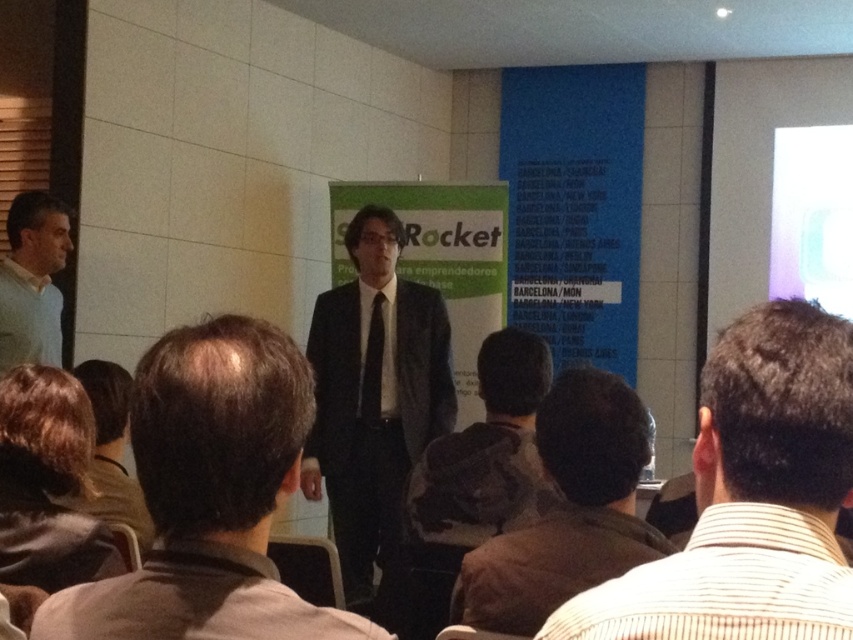
Question: Among these points, which one is farthest from the camera?

Choices:
 (A) (331, 467)
 (B) (489, 468)
 (C) (610, 502)

Answer: (A)

Question: Which point is closer to the camera?

Choices:
 (A) (601, 572)
 (B) (16, 547)
 (C) (241, 582)

Answer: (C)

Question: Which of the following is the farthest from the observer?

Choices:
 (A) (4, 332)
 (B) (357, 365)
 (C) (79, 472)
 (D) (148, 451)

Answer: (B)

Question: Is dark brown suit at center below dark gray suit at center?

Choices:
 (A) yes
 (B) no

Answer: (B)

Question: Can you confirm if dark brown suit at center is thinner than light blue sweater at left?

Choices:
 (A) no
 (B) yes

Answer: (A)

Question: Can you confirm if dark gray suit at center is positioned to the left of brown hair at lower left?

Choices:
 (A) yes
 (B) no

Answer: (B)